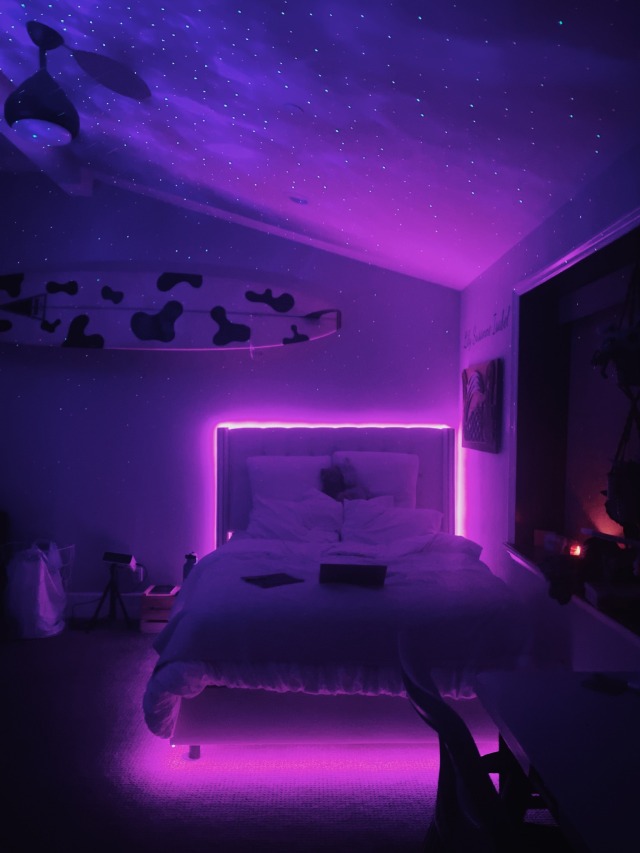
You are a GUI agent. You are given a task and a screenshot of the screen. Output one action in this format:
    pyautogui.click(x=<x>, y=<y>)
    Task: Click on the baseboard
    
    Given the screenshot: What is the action you would take?
    pyautogui.click(x=79, y=601)